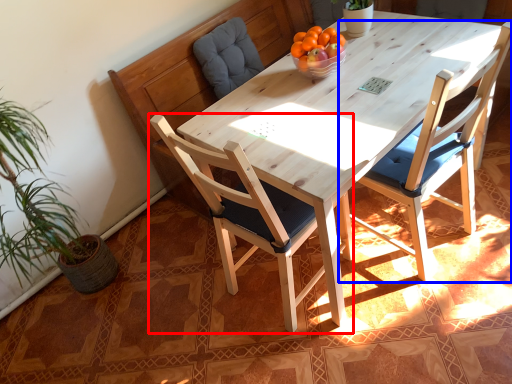
Question: Which object appears farthest to the camera in this image, chair (highlighted by a red box) or chair (highlighted by a blue box)?

Choices:
 (A) chair
 (B) chair

Answer: (B)